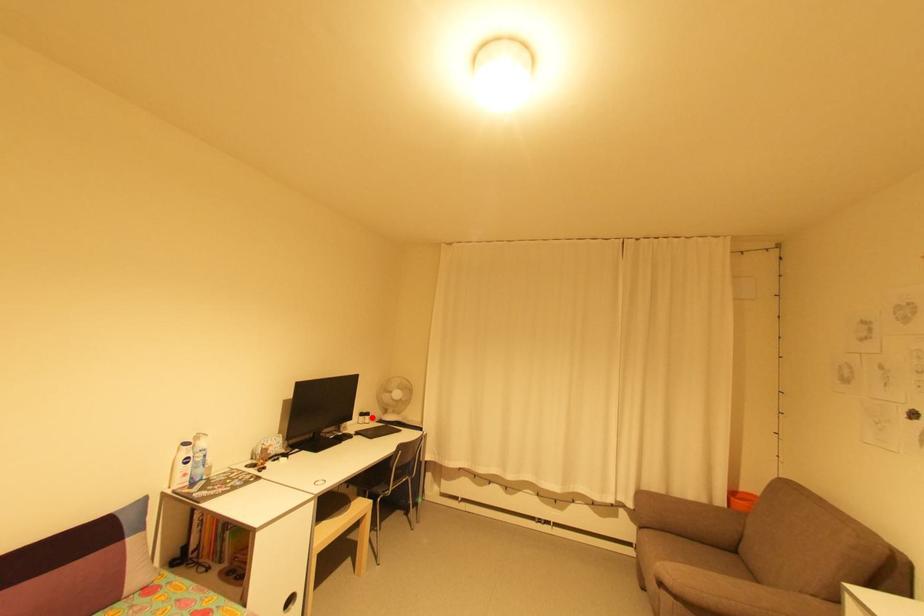
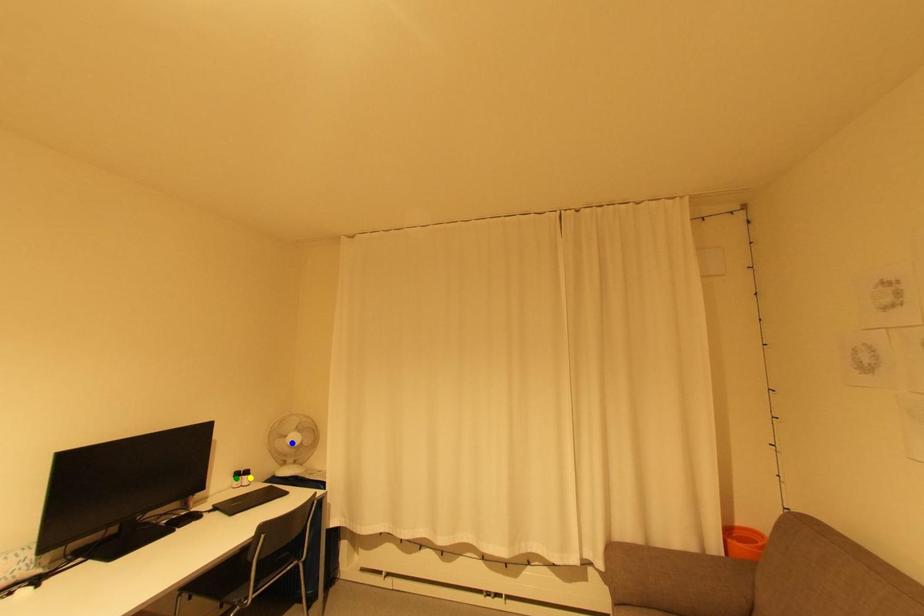
Question: I am providing you with two images of the same scene from different viewpoints. A red point is marked on the first image. You are given multiple points on the second image. Can you choose the point in image 2 that corresponds to the point in image 1?

Choices:
 (A) green point
 (B) blue point
 (C) yellow point

Answer: (C)